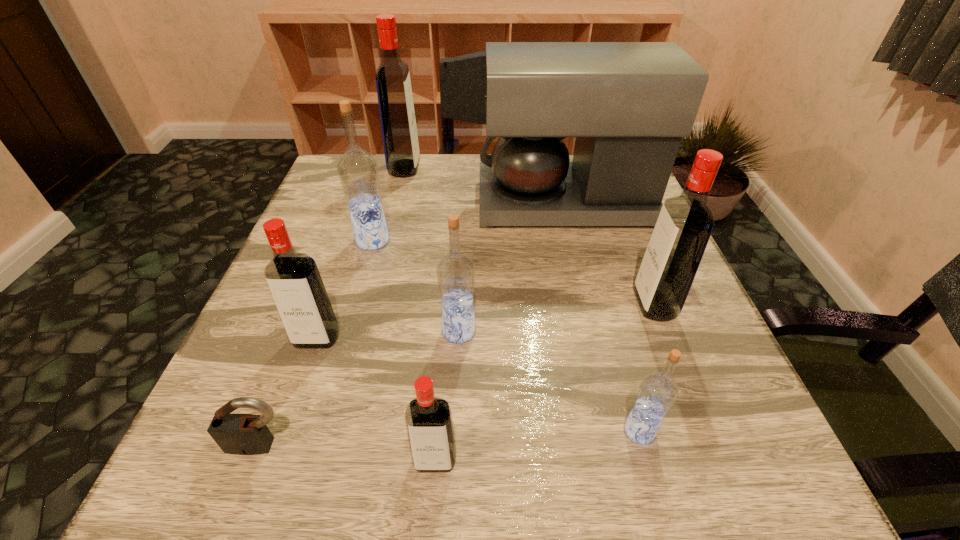
The width and height of the screenshot is (960, 540). Identify the location of object that is the fifth closest to the coffee maker. (295, 283).

What are the coordinates of `the sixth closest vodka relative to the leftmost blue vodka` in the screenshot? It's located at (658, 391).

Identify which vodka is located as the second nearest to the third biggest red vodka. Please provide its 2D coordinates. Your answer should be formatted as a tuple, i.e. [(x, y)], where the tuple contains the x and y coordinates of a point satisfying the conditions above.

[(358, 171)]

This screenshot has height=540, width=960. Find the location of `red vodka that is the second closest one to the sixth vodka from left to right`. red vodka that is the second closest one to the sixth vodka from left to right is located at coordinates (429, 423).

At what (x,y) coordinates should I click in order to perform the action: click on red vodka that is the third closest to the second blue vodka from right to left. Please return your answer as a coordinate pair (x, y). The image size is (960, 540). Looking at the image, I should click on (685, 223).

Locate which blue vodka is the second closest to the second farthest vodka. Please provide its 2D coordinates. Your answer should be formatted as a tuple, i.e. [(x, y)], where the tuple contains the x and y coordinates of a point satisfying the conditions above.

[(658, 391)]

At what (x,y) coordinates should I click in order to perform the action: click on the third closest blue vodka to the second smallest red vodka. Please return your answer as a coordinate pair (x, y). Looking at the image, I should click on (658, 391).

This screenshot has width=960, height=540. I want to click on vacant position in the image that satisfies the following two spatial constraints: 1. on the carafe side of the coffee maker; 2. on the front and back of the second nearest red vodka, so click(x=598, y=339).

The image size is (960, 540). What are the coordinates of `vacant position in the image that satisfies the following two spatial constraints: 1. on the front and back of the second nearest red vodka; 2. on the right side of the sixth vodka from left to right` in the screenshot? It's located at (285, 431).

Find the location of a particular element. The height and width of the screenshot is (540, 960). free space that satisfies the following two spatial constraints: 1. on the front and back of the third nearest red vodka; 2. on the front and back of the third farthest red vodka is located at coordinates point(667,339).